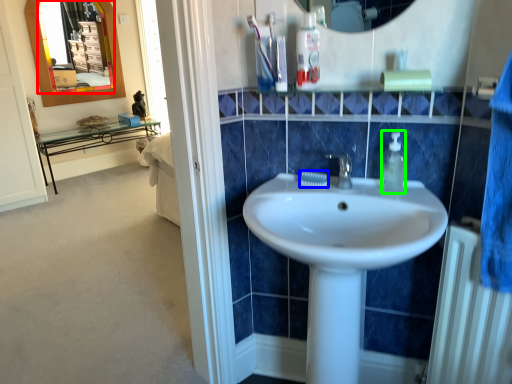
Question: Which object is the farthest from mirror (highlighted by a red box)? Choose among these: toothpaste (highlighted by a blue box) or soap dispenser (highlighted by a green box).

Choices:
 (A) toothpaste
 (B) soap dispenser

Answer: (B)